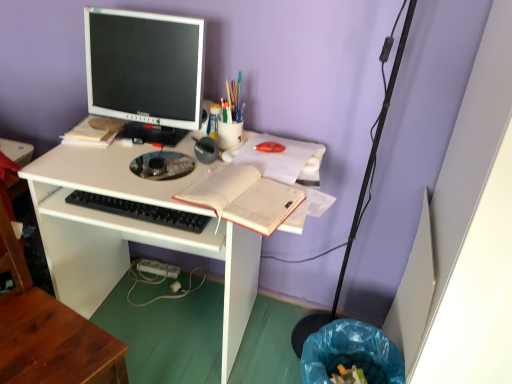
Identify the location of free point above white paper notebook at center (from a real-world perspective). Image resolution: width=512 pixels, height=384 pixels. (227, 181).